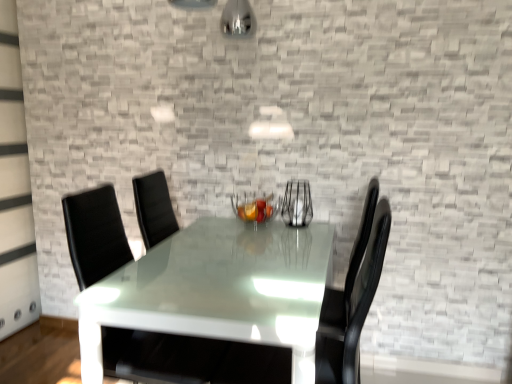
Where is `unoccupied region to the right of clear glass vase at center`? The width and height of the screenshot is (512, 384). unoccupied region to the right of clear glass vase at center is located at coordinates (320, 226).